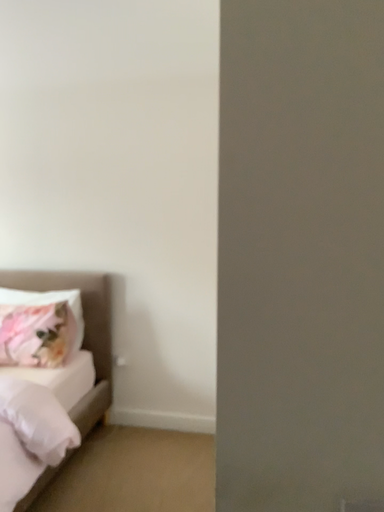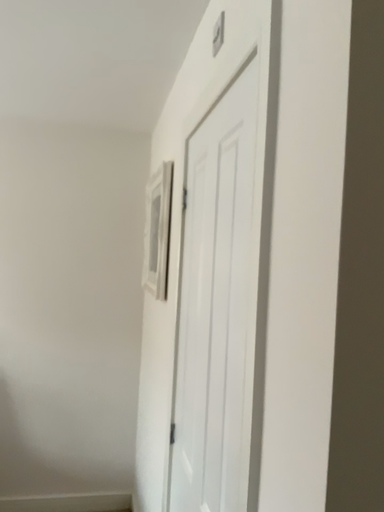
Question: How did the camera likely rotate when shooting the video?

Choices:
 (A) rotated left
 (B) rotated right

Answer: (B)